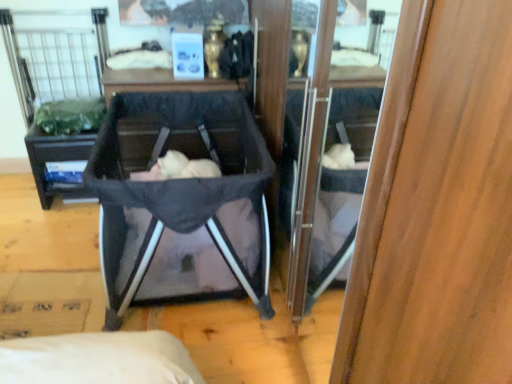
Question: From the image's perspective, would you say dark gray fabric baby carriage at center is positioned over soft pink fabric at center?

Choices:
 (A) yes
 (B) no

Answer: (A)

Question: Is dark gray fabric baby carriage at center aimed at soft pink fabric at center?

Choices:
 (A) yes
 (B) no

Answer: (A)

Question: From a real-world perspective, is dark gray fabric baby carriage at center located higher than soft pink fabric at center?

Choices:
 (A) yes
 (B) no

Answer: (A)

Question: Are dark gray fabric baby carriage at center and soft pink fabric at center far apart?

Choices:
 (A) yes
 (B) no

Answer: (B)

Question: Is soft pink fabric at center inside dark gray fabric baby carriage at center?

Choices:
 (A) no
 (B) yes

Answer: (B)

Question: From the image's perspective, would you say dark gray fabric baby carriage at center is shown under soft pink fabric at center?

Choices:
 (A) no
 (B) yes

Answer: (A)

Question: Does soft pink fabric at center have a greater height compared to dark gray fabric baby carriage at center?

Choices:
 (A) yes
 (B) no

Answer: (B)

Question: From the image's perspective, is soft pink fabric at center on top of dark gray fabric baby carriage at center?

Choices:
 (A) yes
 (B) no

Answer: (B)

Question: Is soft pink fabric at center positioned with its back to dark gray fabric baby carriage at center?

Choices:
 (A) yes
 (B) no

Answer: (A)

Question: Is soft pink fabric at center positioned beyond the bounds of dark gray fabric baby carriage at center?

Choices:
 (A) yes
 (B) no

Answer: (B)

Question: Is dark gray fabric baby carriage at center a part of soft pink fabric at center?

Choices:
 (A) yes
 (B) no

Answer: (B)

Question: Is soft pink fabric at center shorter than dark gray fabric baby carriage at center?

Choices:
 (A) yes
 (B) no

Answer: (A)

Question: Is the surface of soft pink fabric at center in direct contact with black matte vanity at center?

Choices:
 (A) no
 (B) yes

Answer: (A)